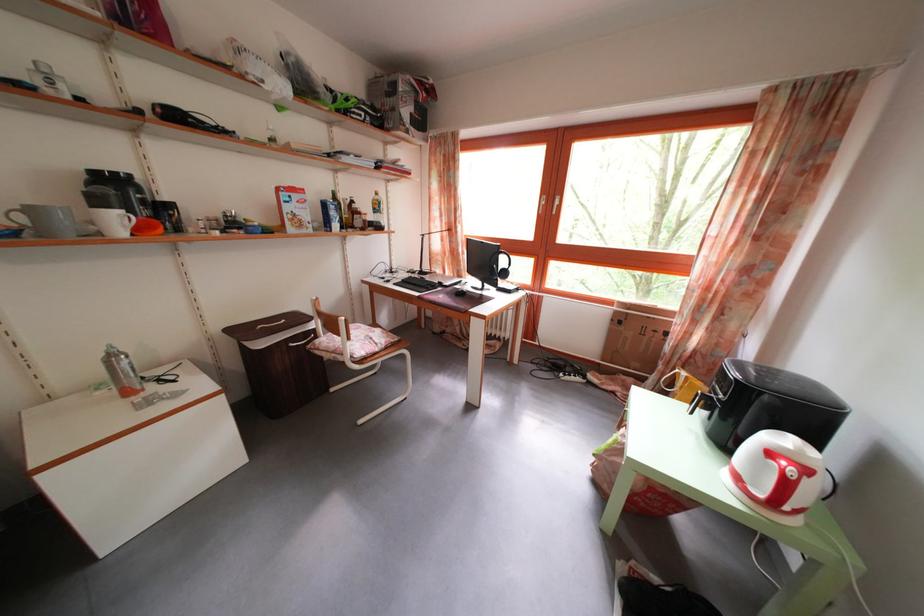
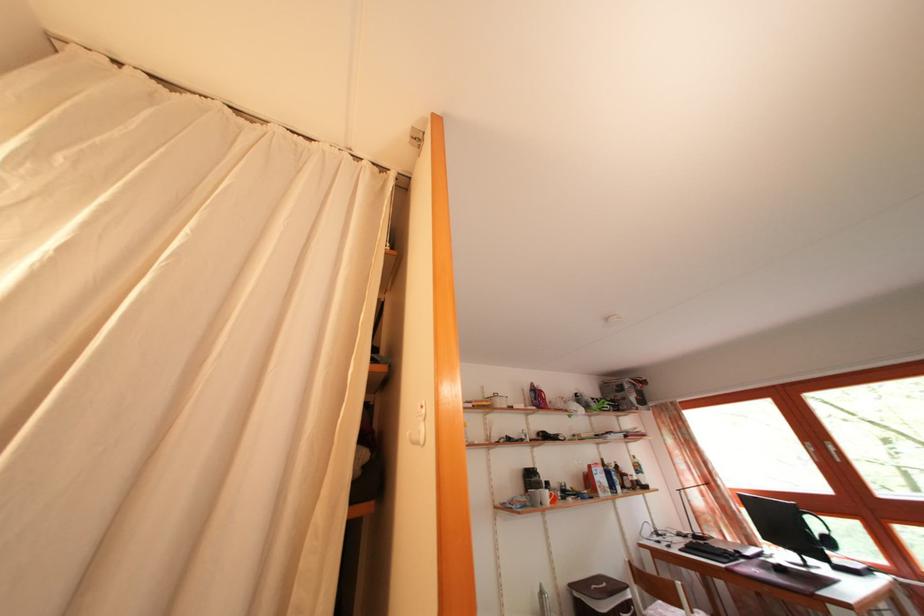
Locate, in the second image, the point that corresponds to pixel 371 217 in the first image.

(636, 480)